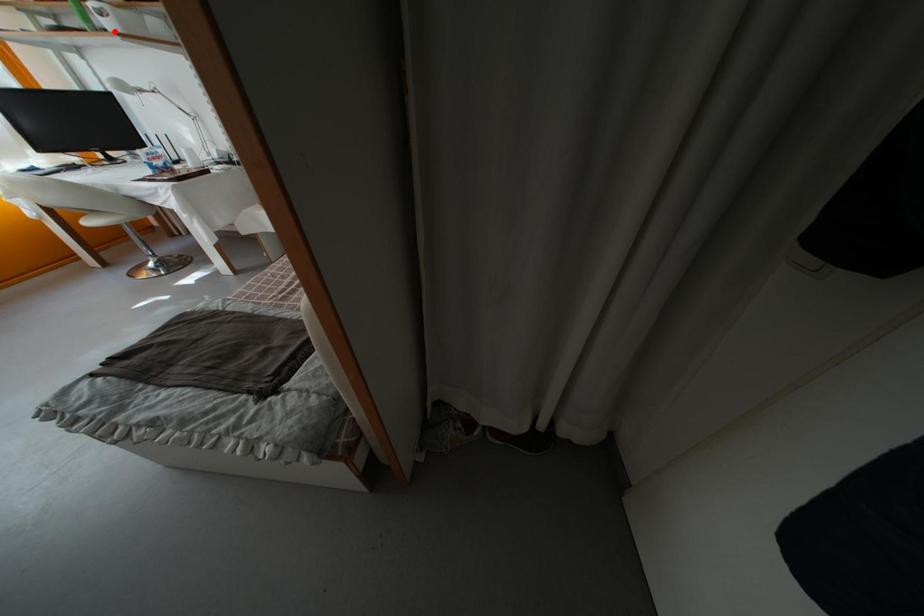
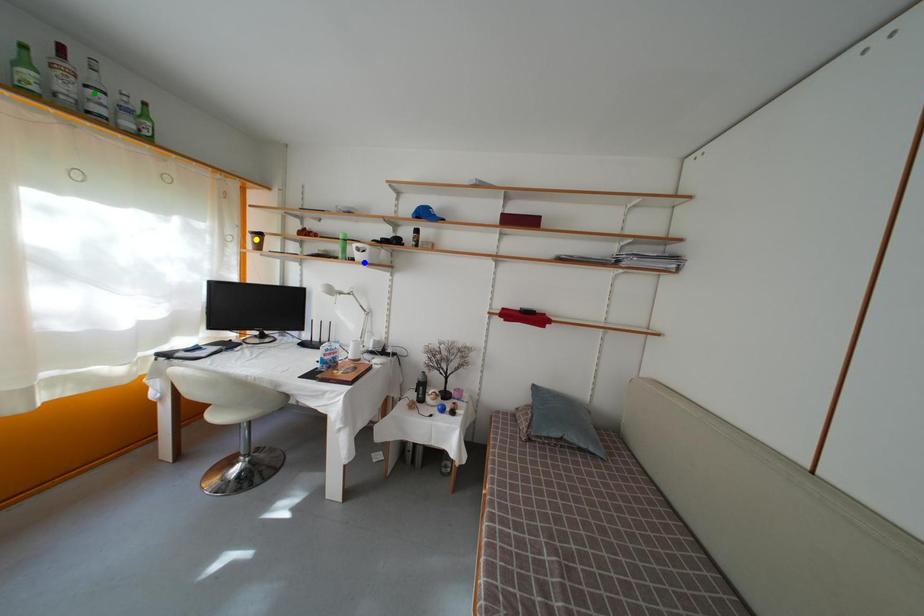
Question: I am providing you with two images of the same scene from different viewpoints. A red point is marked on the first image. You are given multiple points on the second image. Which point in image 2 represents the same 3d spot as the red point in image 1?

Choices:
 (A) green point
 (B) blue point
 (C) yellow point

Answer: (B)